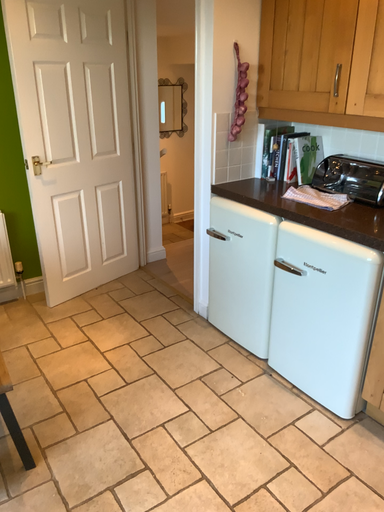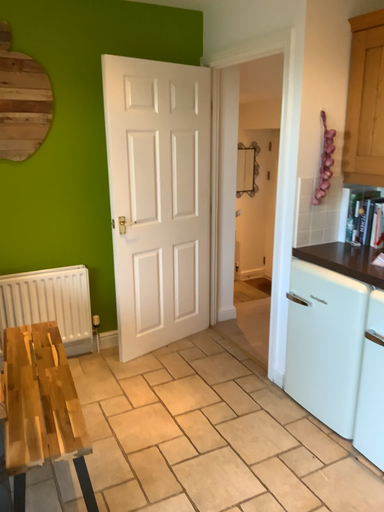
Question: How did the camera likely rotate when shooting the video?

Choices:
 (A) rotated downward
 (B) rotated upward

Answer: (B)